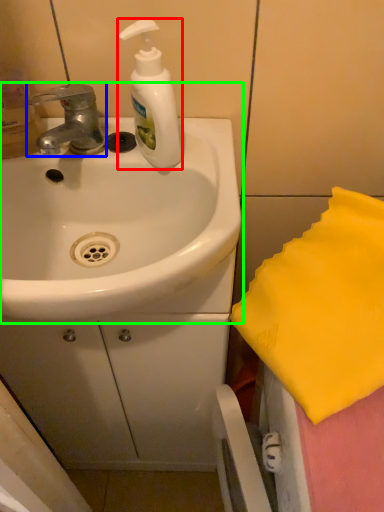
Question: Which object is positioned closest to soap dispenser (highlighted by a red box)? Select from tap (highlighted by a blue box) and sink (highlighted by a green box).

Choices:
 (A) tap
 (B) sink

Answer: (A)